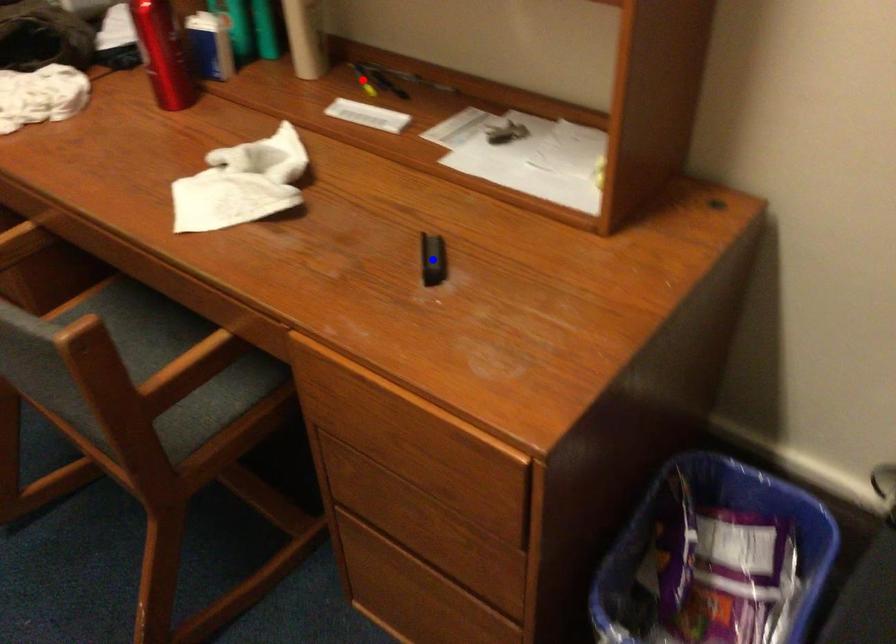
Question: Which of the two points in the image is closer to the camera?

Choices:
 (A) Blue point is closer.
 (B) Red point is closer.

Answer: (A)